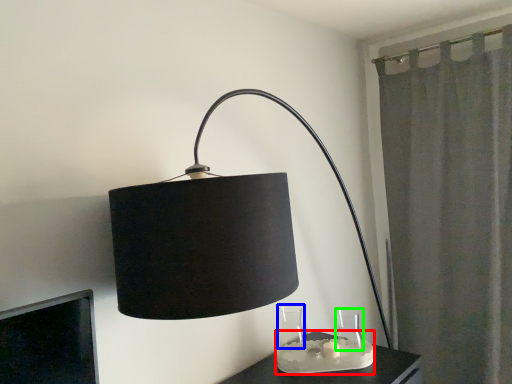
Question: Which object is the farthest from candle holder (highlighted by a red box)? Choose among these: glass vase (highlighted by a blue box) or glass vase (highlighted by a green box).

Choices:
 (A) glass vase
 (B) glass vase

Answer: (B)